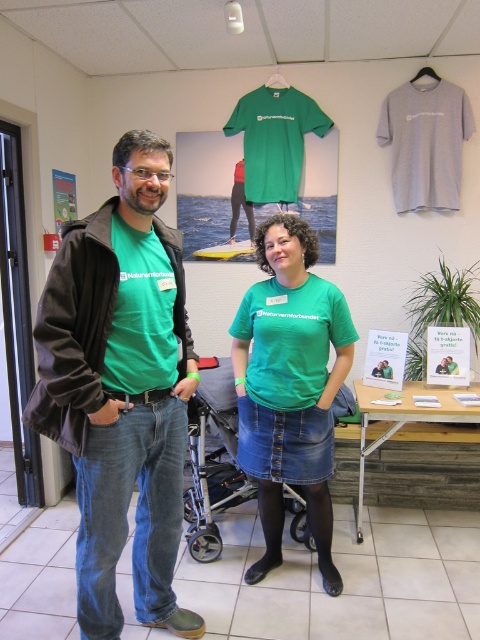
Question: Which object is farther from the camera taking this photo?

Choices:
 (A) matte green t-shirt at center
 (B) green fabric shirt at center

Answer: (B)

Question: Among these objects, which one is farthest from the camera?

Choices:
 (A) matte green t-shirt at center
 (B) green fabric shirt at center
 (C) metallic gray baby carriage at center

Answer: (C)

Question: Can you confirm if green fabric shirt at center is positioned to the left of metallic gray baby carriage at center?

Choices:
 (A) no
 (B) yes

Answer: (A)

Question: Where is matte green t-shirt at center located in relation to metallic gray baby carriage at center in the image?

Choices:
 (A) left
 (B) right

Answer: (A)

Question: Can you confirm if matte green t-shirt at center is positioned to the left of metallic gray baby carriage at center?

Choices:
 (A) no
 (B) yes

Answer: (B)

Question: Which of the following is the farthest from the observer?

Choices:
 (A) matte green t-shirt at center
 (B) metallic gray baby carriage at center

Answer: (B)